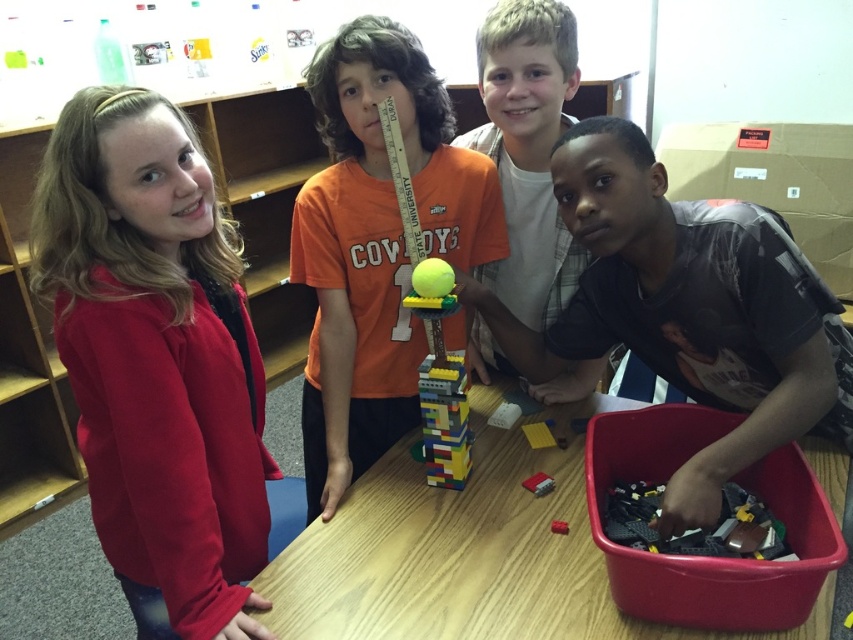
Looking at this image, you are a teacher observing the children at the table. You need to hand a tool to the child wearing the orange cotton shirt at center without disturbing the bright yellow plastic ball at center. Which child should you approach first?

You should approach the child wearing the orange cotton shirt at center first because they are closer to you compared to the bright yellow plastic ball at center, which is further away. This allows you to hand the tool without disturbing the ball.

You are a teacher observing the children at the table. You notice the orange cotton shirt at center and the matte red brick at center. Which object takes up more space visually?

The orange cotton shirt at center has a larger size compared to the matte red brick at center, so it takes up more visual space.

From the picture: You are a teacher observing the children at the wooden table. You notice the orange cotton shirt at center and the bright yellow plastic ball at center. Which object is taller?

The orange cotton shirt at center is much taller than the bright yellow plastic ball at center.